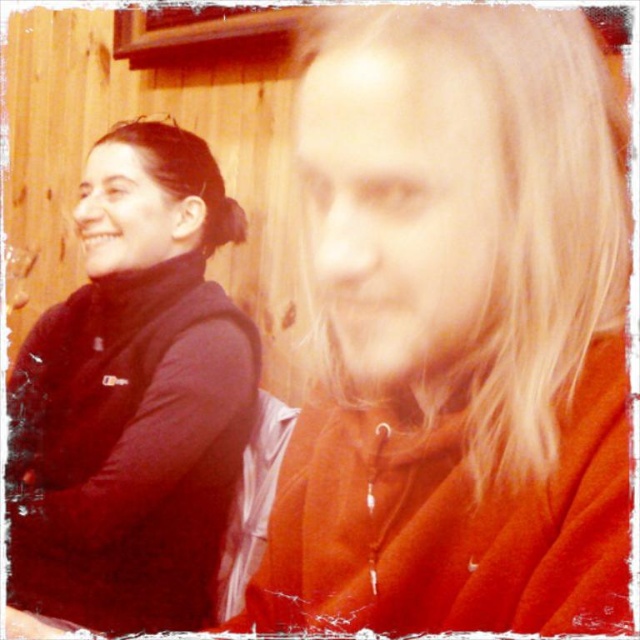
Is orange fleece jacket at center positioned at the back of black fleece at left?

No.

Who is more forward, (320, 609) or (54, 378)?

Positioned in front is point (320, 609).

Does point (520, 566) come farther from viewer compared to point (156, 292)?

No, it is in front of (156, 292).

This screenshot has height=640, width=640. I want to click on orange fleece jacket at center, so click(x=458, y=332).